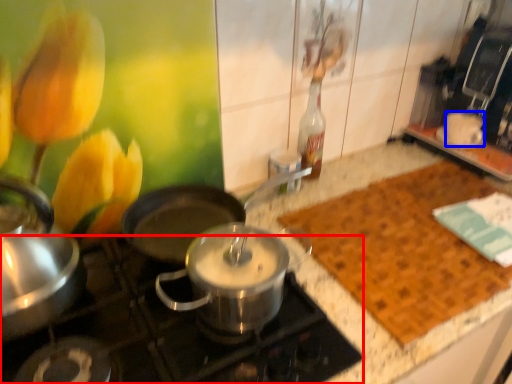
Question: Among these objects, which one is nearest to the camera, gas stove (highlighted by a red box) or coffee cup (highlighted by a blue box)?

Choices:
 (A) gas stove
 (B) coffee cup

Answer: (A)